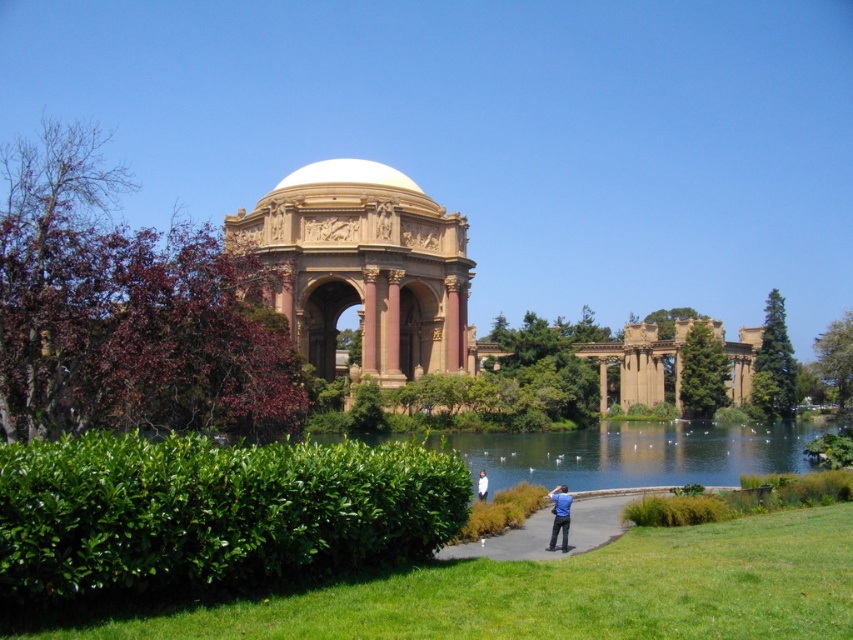
Question: Which point is closer to the camera?

Choices:
 (A) blue shirt at center
 (B) green grass at center

Answer: (B)

Question: Which object appears farthest from the camera in this image?

Choices:
 (A) blue cotton shirt at center
 (B) blue shirt at center
 (C) white marble dome at center

Answer: (C)

Question: Does golden stone palace at center have a greater width compared to green leafy bush at center?

Choices:
 (A) no
 (B) yes

Answer: (B)

Question: Is green grass at center to the right of blue shirt at center from the viewer's perspective?

Choices:
 (A) yes
 (B) no

Answer: (A)

Question: Which point is farther to the camera?

Choices:
 (A) green leafy bush at center-right
 (B) golden stone palace at center
 (C) green leafy hedge at lower left
 (D) white marble dome at center

Answer: (A)

Question: Does golden stone palace at center appear on the left side of blue shirt at center?

Choices:
 (A) no
 (B) yes

Answer: (A)